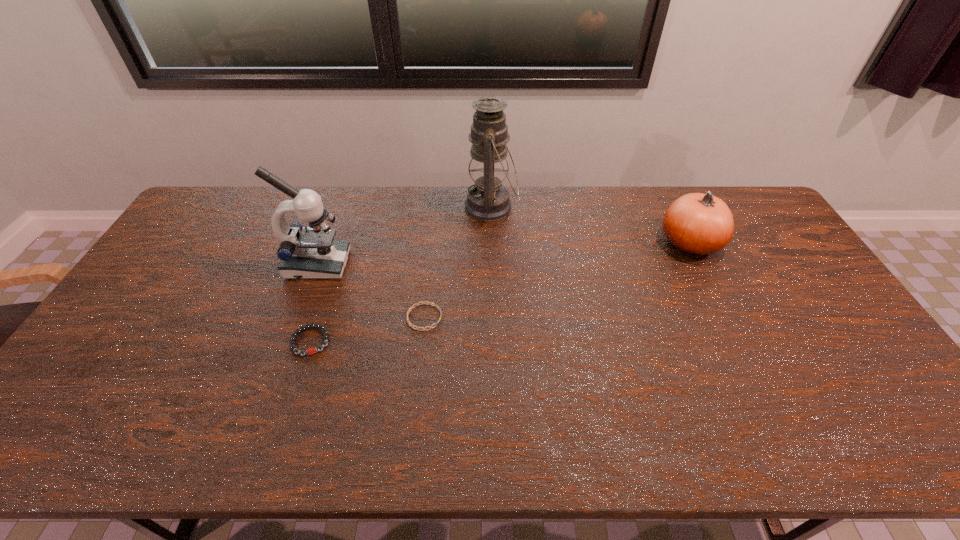
Identify the location of free space located on the left of the third tallest object. Image resolution: width=960 pixels, height=540 pixels. (636, 242).

At what (x,y) coordinates should I click in order to perform the action: click on vacant region located 0.120m on the right of the taller bracelet. Please return your answer as a coordinate pair (x, y). This screenshot has height=540, width=960. Looking at the image, I should click on (374, 341).

In order to click on vacant space located on the surface of the shorter bracelet showing star-shaped elements in this screenshot , I will do `click(477, 317)`.

This screenshot has height=540, width=960. What are the coordinates of `oil lamp at the far edge` in the screenshot? It's located at (487, 200).

This screenshot has width=960, height=540. Identify the location of pumpkin at the far edge. (x=697, y=224).

Locate an element on the screen. The width and height of the screenshot is (960, 540). vacant area at the far edge is located at coordinates (657, 190).

Identify the location of vacant region at the near edge of the desktop. This screenshot has width=960, height=540. (353, 424).

Find the location of a particular element. vacant region at the left edge of the desktop is located at coordinates (161, 304).

Where is `vacant area at the right edge`? vacant area at the right edge is located at coordinates (806, 344).

Where is `vacant area at the far right corner of the desktop`? This screenshot has width=960, height=540. vacant area at the far right corner of the desktop is located at coordinates (734, 206).